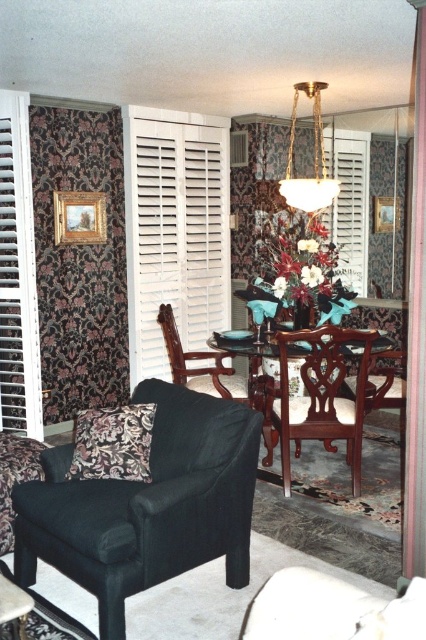
Is velvet black couch at lower left positioned in front of white wood shutter at right?

That is True.

Does point (319, 630) come behind point (328, 224)?

No, (319, 630) is closer to viewer.

Where is `velvet black couch at lower left`? velvet black couch at lower left is located at coordinates (331, 609).

Is point (230, 436) more distant than point (19, 476)?

No, (230, 436) is in front of (19, 476).

Is point (46, 467) less distant than point (5, 458)?

Yes, point (46, 467) is in front of point (5, 458).

This screenshot has height=640, width=426. In order to click on black fabric couch at lower left in this screenshot , I will do `click(146, 506)`.

Is white wooden shutter at left above black leather couch at lower left?

→ Indeed, white wooden shutter at left is positioned over black leather couch at lower left.

Which is behind, point (16, 209) or point (28, 449)?

The point (16, 209) is behind.

At what (x,y) coordinates should I click in order to perform the action: click on white wooden shutter at left. Please return your answer as a coordinate pair (x, y). Looking at the image, I should click on (17, 275).